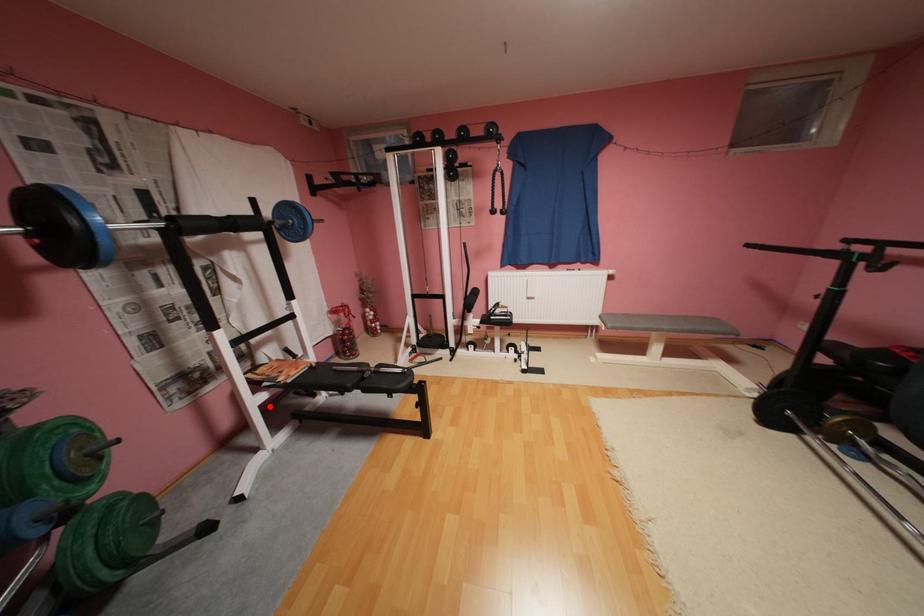
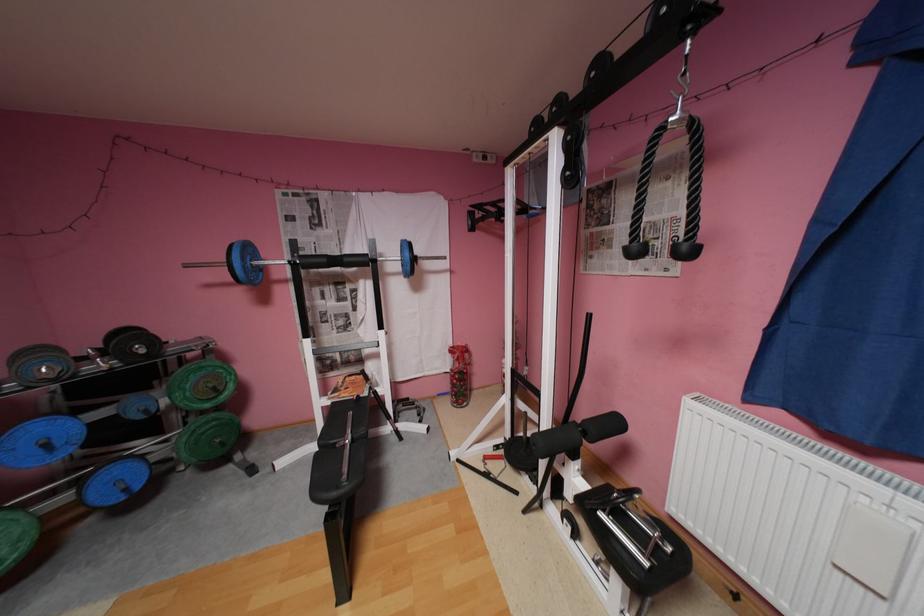
Question: A red point is marked in image1. In image2, is the corresponding 3D point closer to the camera or farther? Reply with the corresponding letter.

Choices:
 (A) The corresponding 3D point is closer.
 (B) The corresponding 3D point is farther.

Answer: (B)